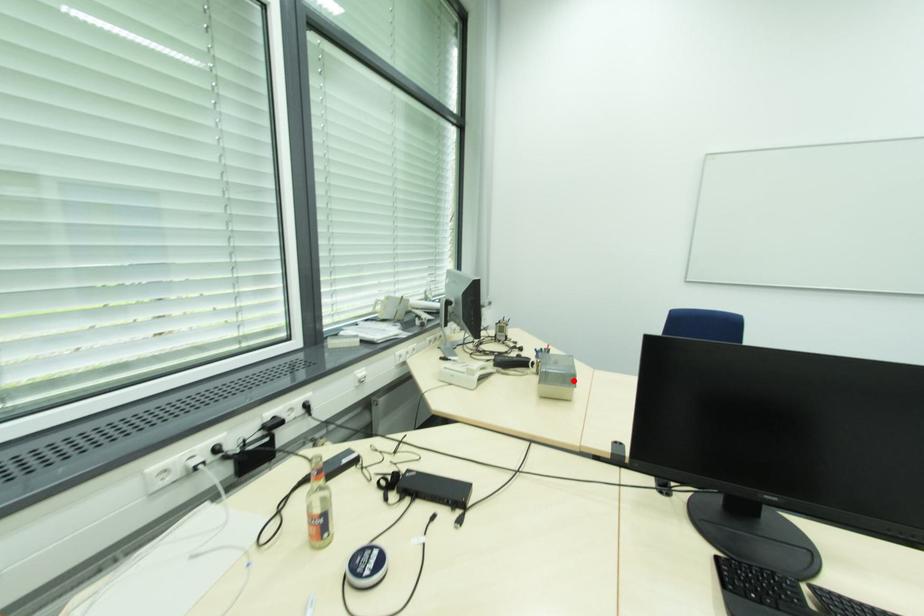
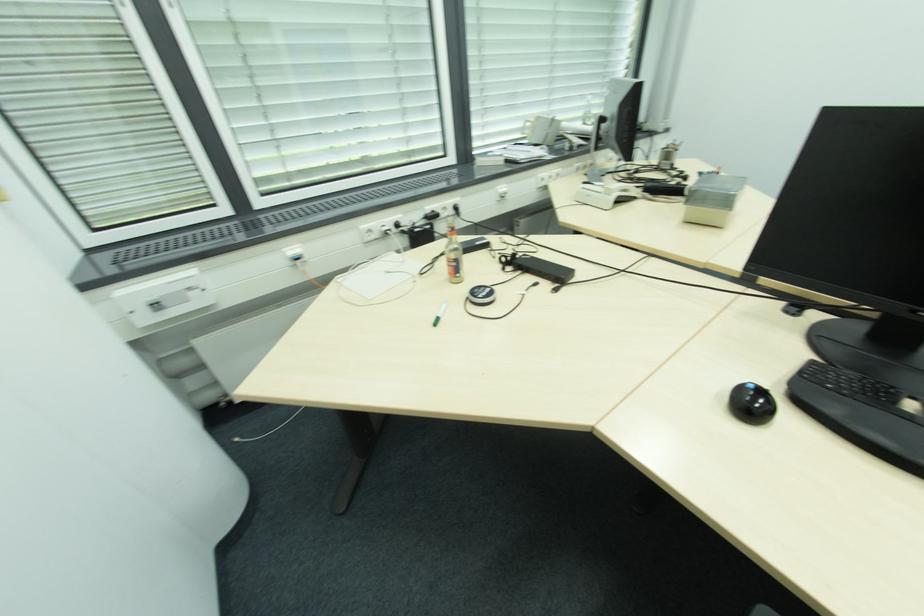
In the second image, find the point that corresponds to the highlighted location in the first image.

(730, 203)